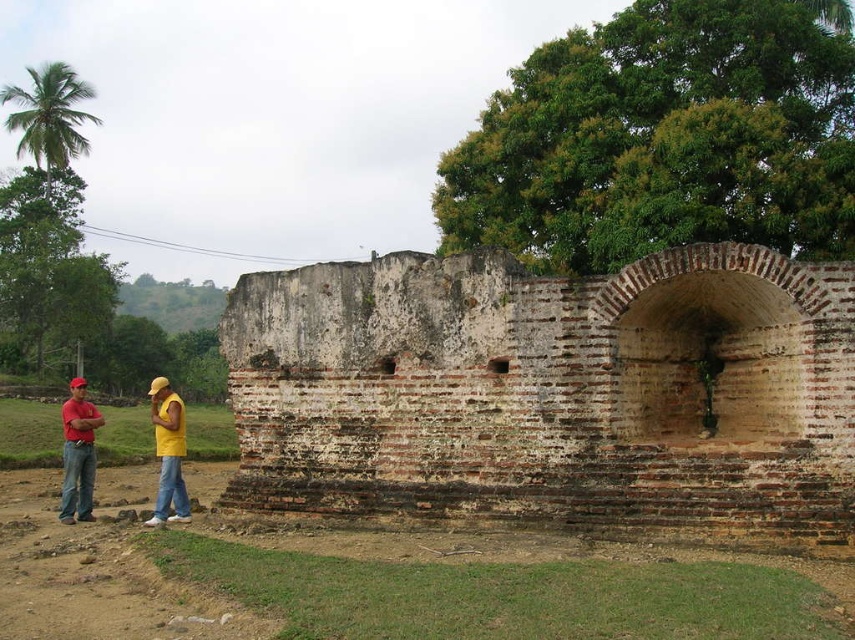
Does point (65, 451) come farther from viewer compared to point (166, 509)?

Yes, it is.

Can you confirm if matte red cap at left is bigger than yellow cotton shirt at center?

No.

Locate an element on the screen. Image resolution: width=855 pixels, height=640 pixels. matte red cap at left is located at coordinates click(78, 452).

Who is lower down, weathered brick wall at center or matte red cap at left?

matte red cap at left is lower down.

Consider the image. Does weathered brick wall at center have a greater height compared to matte red cap at left?

Yes, weathered brick wall at center is taller than matte red cap at left.

Is point (808, 376) closer to viewer compared to point (75, 433)?

Yes, point (808, 376) is in front of point (75, 433).

Find the location of a particular element. The width and height of the screenshot is (855, 640). weathered brick wall at center is located at coordinates (550, 392).

Is weathered brick wall at center in front of yellow cotton shirt at center?

Yes, it is in front of yellow cotton shirt at center.

Based on the photo, can you confirm if weathered brick wall at center is thinner than yellow cotton shirt at center?

Correct, weathered brick wall at center's width is less than yellow cotton shirt at center's.

Locate an element on the screen. weathered brick wall at center is located at coordinates point(550,392).

At what (x,y) coordinates should I click in order to perform the action: click on weathered brick wall at center. Please return your answer as a coordinate pair (x, y). The height and width of the screenshot is (640, 855). Looking at the image, I should click on (550, 392).